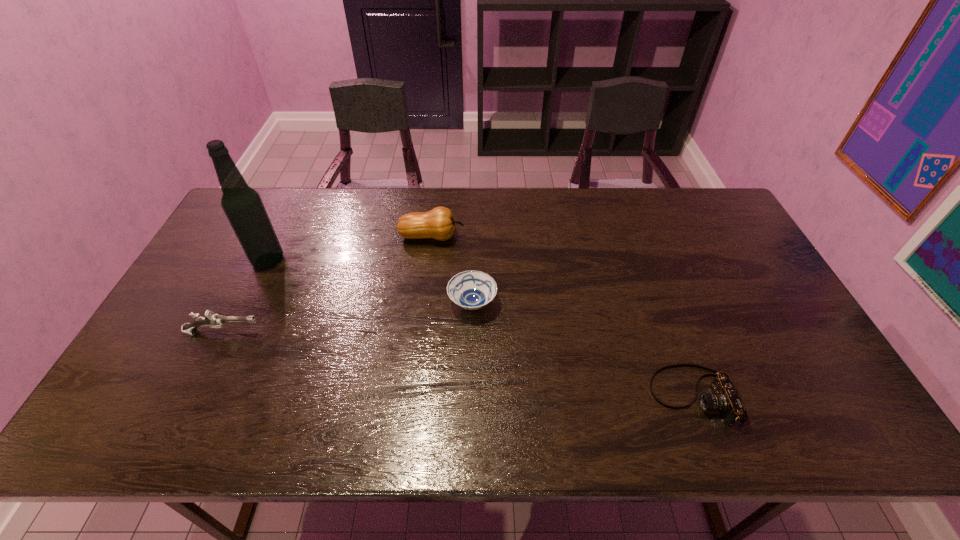
Identify the location of alcohol. This screenshot has height=540, width=960. (243, 206).

The height and width of the screenshot is (540, 960). I want to click on the tallest object, so click(243, 206).

Identify the location of the farthest object. This screenshot has height=540, width=960. [438, 223].

The width and height of the screenshot is (960, 540). I want to click on gourd, so click(438, 223).

The image size is (960, 540). Identify the location of the third tallest object. (212, 320).

You are a GUI agent. You are given a task and a screenshot of the screen. Output one action in this format:
    pyautogui.click(x=<x>, y=<y>)
    Task: Click on the second nearest object
    
    Given the screenshot: What is the action you would take?
    pyautogui.click(x=212, y=320)

Where is `soup bowl`? The width and height of the screenshot is (960, 540). soup bowl is located at coordinates (472, 290).

Identify the location of the nearest object. The width and height of the screenshot is (960, 540). (724, 397).

Find the location of a particular element. This screenshot has width=960, height=540. the rightmost object is located at coordinates (724, 397).

The height and width of the screenshot is (540, 960). Find the location of `vacant position located 0.080m on the right of the second farthest object`. vacant position located 0.080m on the right of the second farthest object is located at coordinates tap(310, 260).